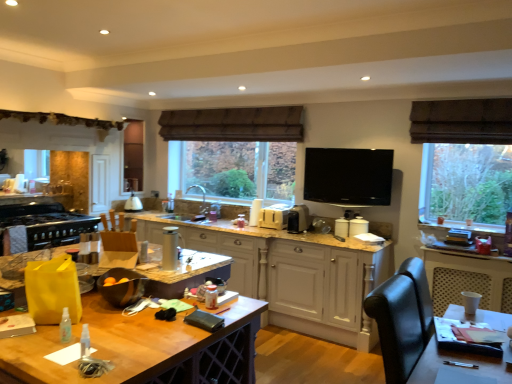
Question: Is wooden table at center completely or partially outside of black matte stove at left, the second appliance from the front?

Choices:
 (A) yes
 (B) no

Answer: (A)

Question: Is black matte stove at left, positioned as the first appliance in left-to-right order, a part of wooden table at center?

Choices:
 (A) yes
 (B) no

Answer: (B)

Question: Does wooden table at center have a larger size compared to black matte stove at left, the second appliance from the front?

Choices:
 (A) yes
 (B) no

Answer: (A)

Question: Considering the relative sizes of wooden table at center and black matte stove at left, positioned as the sixth appliance in right-to-left order, in the image provided, is wooden table at center taller than black matte stove at left, positioned as the sixth appliance in right-to-left order,?

Choices:
 (A) no
 (B) yes

Answer: (B)

Question: Are wooden table at center and black matte stove at left, the second appliance from the front, making contact?

Choices:
 (A) yes
 (B) no

Answer: (B)

Question: Is matte white lampshade at center, positioned as the 2th appliance in left-to-right order, taller or shorter than brown fabric exhaust hood at upper center?

Choices:
 (A) tall
 (B) short

Answer: (B)

Question: In the image, is matte white lampshade at center, the fifth appliance viewed from the right, positioned in front of or behind brown fabric exhaust hood at upper center?

Choices:
 (A) behind
 (B) front

Answer: (A)

Question: Is matte white lampshade at center, positioned as the 6th appliance in front-to-back order, situated inside brown fabric exhaust hood at upper center or outside?

Choices:
 (A) outside
 (B) inside

Answer: (A)

Question: Is point (132, 205) positioned closer to the camera than point (253, 122)?

Choices:
 (A) closer
 (B) farther

Answer: (B)

Question: Based on their positions, is wooden table at center located to the left or right of flat screen tv at upper center, marked as the sixth appliance in a left-to-right arrangement?

Choices:
 (A) left
 (B) right

Answer: (A)

Question: Relative to flat screen tv at upper center, marked as the sixth appliance in a left-to-right arrangement, is wooden table at center in front or behind?

Choices:
 (A) front
 (B) behind

Answer: (A)

Question: From the image's perspective, relative to flat screen tv at upper center, which ranks as the first appliance in right-to-left order, is wooden table at center above or below?

Choices:
 (A) below
 (B) above

Answer: (A)

Question: Looking at their shapes, would you say wooden table at center is wider or thinner than flat screen tv at upper center, which ranks as the first appliance in right-to-left order?

Choices:
 (A) thin
 (B) wide

Answer: (B)

Question: Looking at their shapes, would you say white painted wood cabinetry at center is wider or thinner than matte white lampshade at center, positioned as the 2th appliance in left-to-right order?

Choices:
 (A) thin
 (B) wide

Answer: (B)

Question: In terms of size, does white painted wood cabinetry at center appear bigger or smaller than matte white lampshade at center, positioned as the 6th appliance in front-to-back order?

Choices:
 (A) big
 (B) small

Answer: (A)